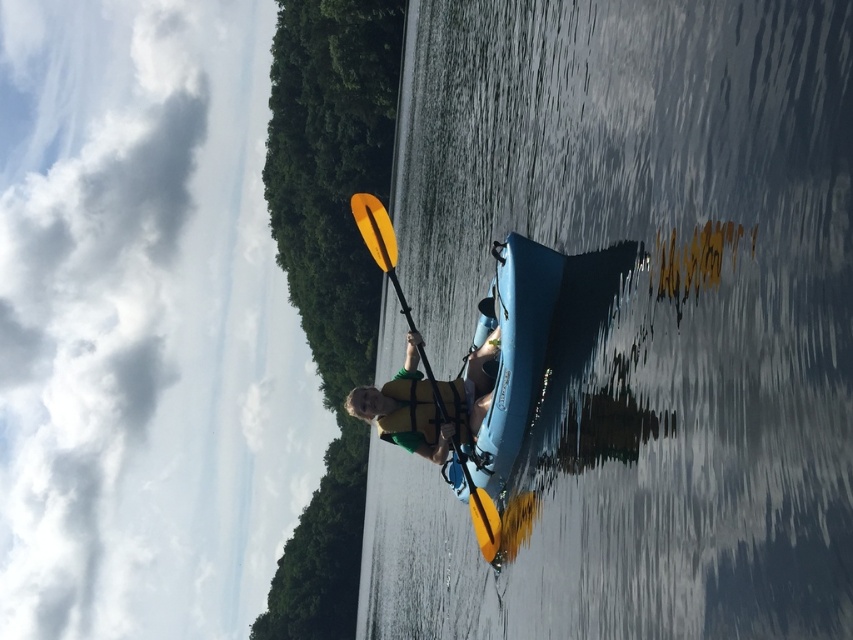
You are a photographer trying to capture the reflection of the blue kayak with a person wearing a yellow life jacket in the clear blue water at center. Based on the coordinates provided, can you determine if the reflection is visible in the water?

The clear blue water at center is located at point (634, 316), so yes, the reflection of the blue kayak with a person wearing a yellow life jacket is visible in the clear blue water at center.